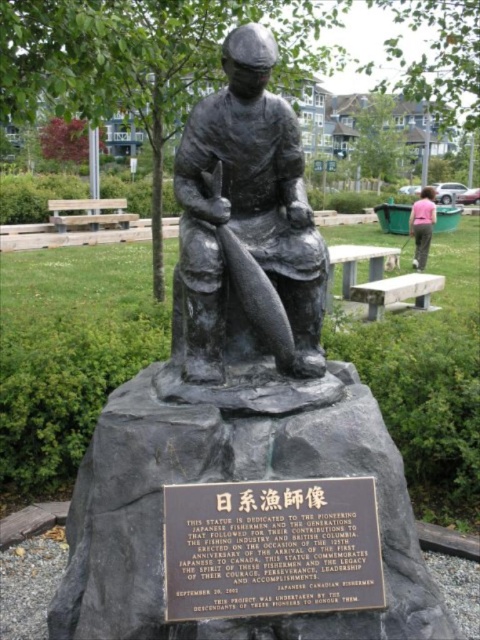
You are standing in front of the bronze statue of the fisherman in the park. There are two points marked on the statue. The first point is at coordinates point (310,264) and the second point is at point (428,186). Which point is closer to you?

Point (310,264) is closer to the viewer than point (428,186).

Looking at this image, you are standing at the base of the bronze statue in the park. You see two points marked on the ground, one at coordinate point (382, 570) and the other at point (410, 227). If you want to walk towards the statue, which point should you approach first?

Point (382, 570) is in front of point (410, 227), so you should approach point (382, 570) first when walking towards the statue.

You are a photographer trying to capture a photo of the bronze statue of fisherman at center and the pink fabric pants at lower right. You want to ensure both subjects are fully visible in the frame. Given that your camera has a fixed focal length and you can only adjust your distance from the statue, which subject should you move closer to in order to include both in the frame without cropping?

The bronze statue of fisherman at center is wider than the pink fabric pants at lower right. To include both in the frame, you should move closer to the bronze statue of fisherman at center so that its larger size can be accommodated while still fitting the smaller pink fabric pants at lower right into the shot.